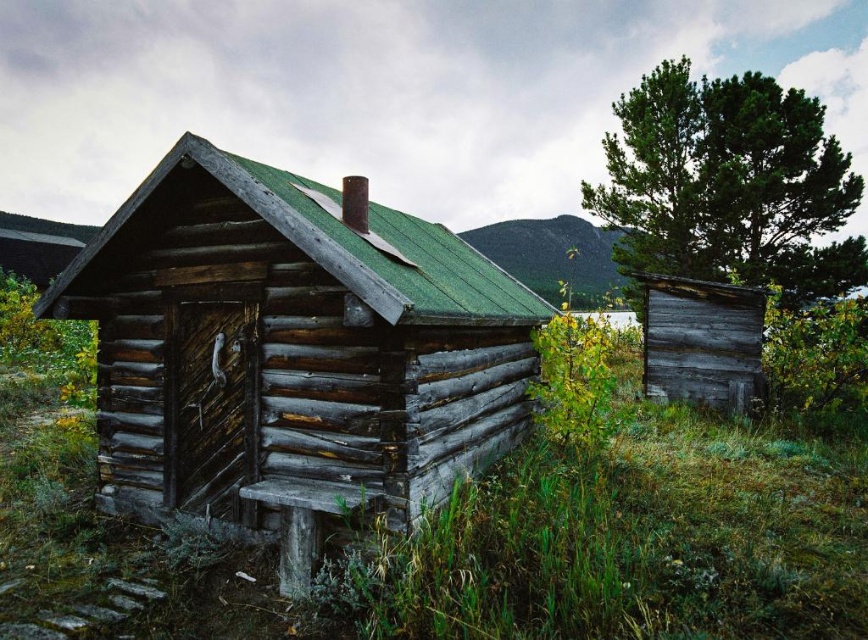
Question: Which object appears farthest from the camera in this image?

Choices:
 (A) weathered wood shed at right
 (B) green textured tree at upper right
 (C) weathered wood cabin at center

Answer: (B)

Question: Can you confirm if weathered wood shed at right is thinner than green shingled roof at upper center?

Choices:
 (A) no
 (B) yes

Answer: (B)

Question: Which of the following is the closest to the observer?

Choices:
 (A) (728, 285)
 (B) (257, 323)
 (C) (569, 221)
 (D) (702, 134)

Answer: (B)

Question: Which object is farther from the camera taking this photo?

Choices:
 (A) green textured tree at upper right
 (B) weathered wood cabin at center
 (C) green shingled roof at upper center
 (D) weathered wood shed at right

Answer: (C)

Question: Is green textured tree at upper right bigger than green shingled roof at upper center?

Choices:
 (A) no
 (B) yes

Answer: (A)

Question: Is the position of weathered wood cabin at center less distant than that of green shingled roof at upper center?

Choices:
 (A) no
 (B) yes

Answer: (B)